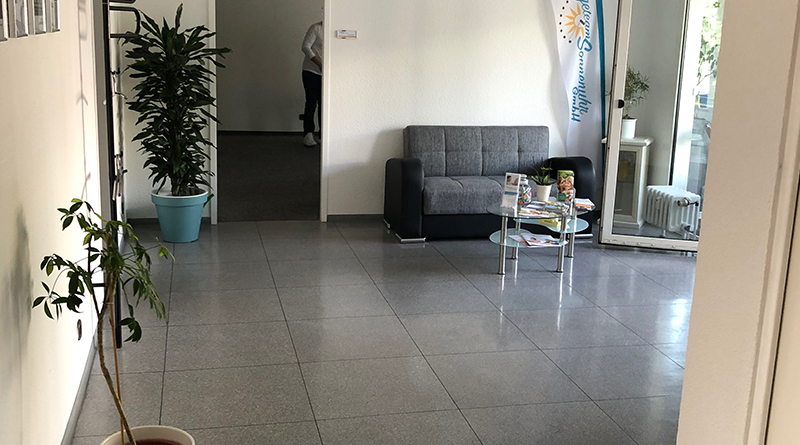
Where is `couch`? couch is located at coordinates (480, 182).